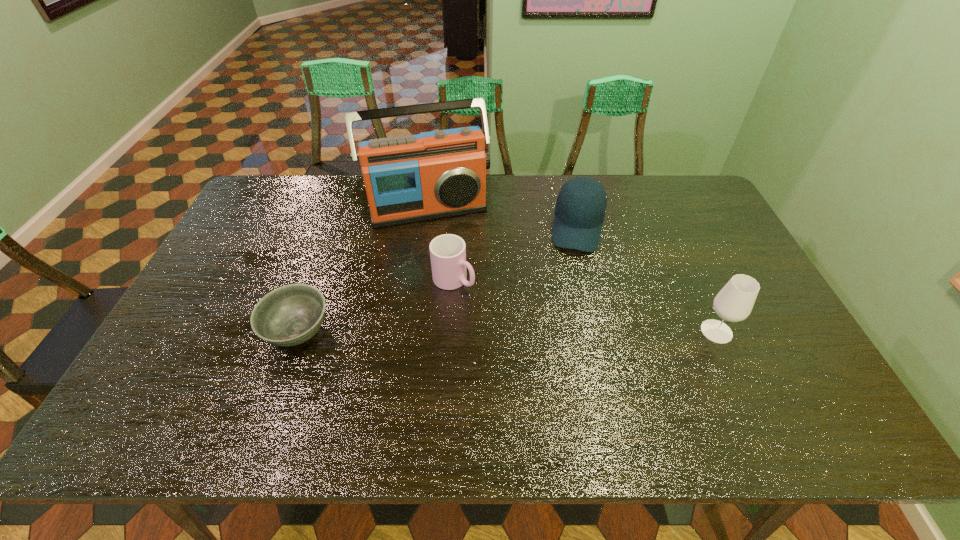
The image size is (960, 540). In order to click on free spot between the third tallest object and the radio receiver in this screenshot , I will do `click(503, 218)`.

In order to click on unoccupied position between the glass and the radio receiver in this screenshot , I will do `click(572, 270)`.

Find the location of a particular element. This screenshot has width=960, height=540. free space between the shortest object and the cup is located at coordinates (376, 306).

The height and width of the screenshot is (540, 960). Find the location of `free space between the rightmost object and the radio receiver`. free space between the rightmost object and the radio receiver is located at coordinates (572, 270).

Identify the location of free space between the fourth object from left to right and the glass. (647, 280).

Find the location of `vacant space that is in between the third tallest object and the tallest object`. vacant space that is in between the third tallest object and the tallest object is located at coordinates (503, 218).

This screenshot has width=960, height=540. In order to click on empty space between the tallest object and the shortest object in this screenshot , I will do `click(363, 270)`.

The width and height of the screenshot is (960, 540). What are the coordinates of `object that stands as the second closest to the glass` in the screenshot? It's located at coord(448,251).

Locate an element on the screen. This screenshot has height=540, width=960. object that is the nearest to the shortest object is located at coordinates (448, 251).

The width and height of the screenshot is (960, 540). I want to click on free space that satisfies the following two spatial constraints: 1. on the front side of the cup; 2. on the left side of the glass, so click(x=451, y=332).